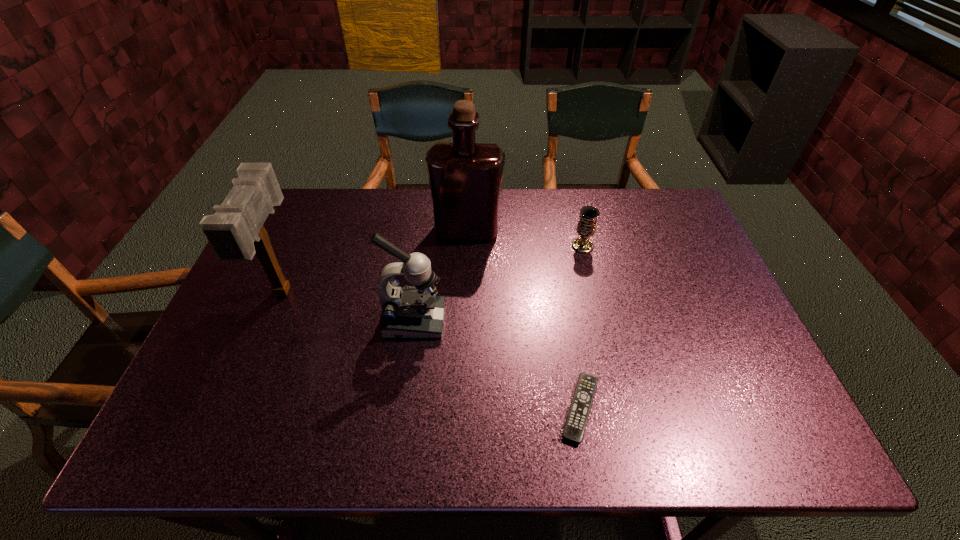
In the image, there is a desktop. Identify the location of vacant area at the far right corner. (636, 217).

At what (x,y) coordinates should I click in order to perform the action: click on vacant space that's between the liquor and the mallet. Please return your answer as a coordinate pair (x, y). The width and height of the screenshot is (960, 540). Looking at the image, I should click on click(x=375, y=260).

At what (x,y) coordinates should I click in order to perform the action: click on unoccupied position between the microscope and the liquor. Please return your answer as a coordinate pair (x, y). The width and height of the screenshot is (960, 540). Looking at the image, I should click on (441, 275).

Where is `empty space that is in between the liquor and the chalice`? This screenshot has height=540, width=960. empty space that is in between the liquor and the chalice is located at coordinates (525, 238).

The height and width of the screenshot is (540, 960). I want to click on vacant space in between the rightmost object and the remote control, so click(581, 327).

Locate an element on the screen. The height and width of the screenshot is (540, 960). blank region between the leftmost object and the microscope is located at coordinates (349, 306).

Find the location of a particular element. The image size is (960, 540). free spot between the fourth tallest object and the microscope is located at coordinates (498, 284).

Identify the location of free space between the second object from right to left and the microscope. point(497,365).

This screenshot has height=540, width=960. I want to click on vacant point located between the second shortest object and the mallet, so click(x=433, y=268).

Find the location of `free space that is in between the tallest object and the microscope`. free space that is in between the tallest object and the microscope is located at coordinates (441, 275).